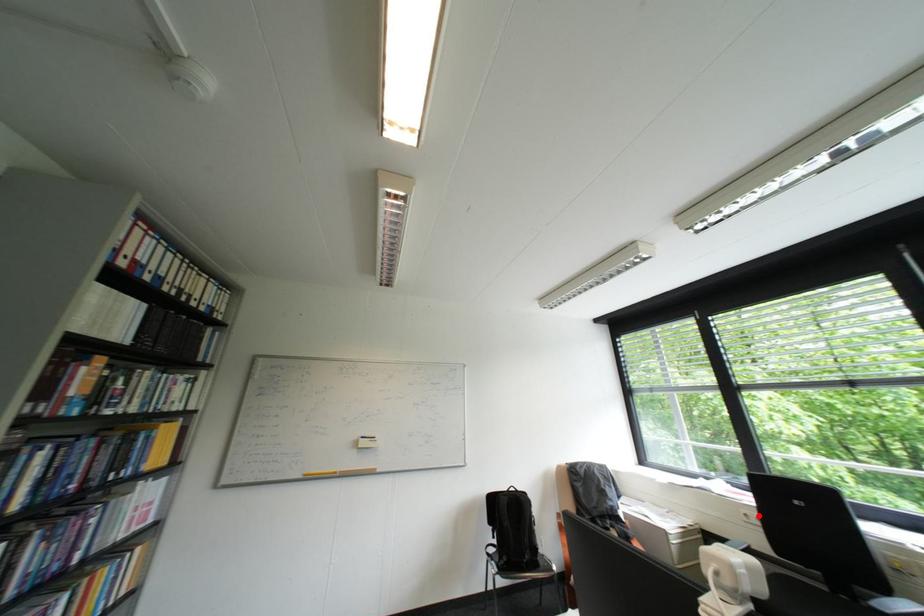
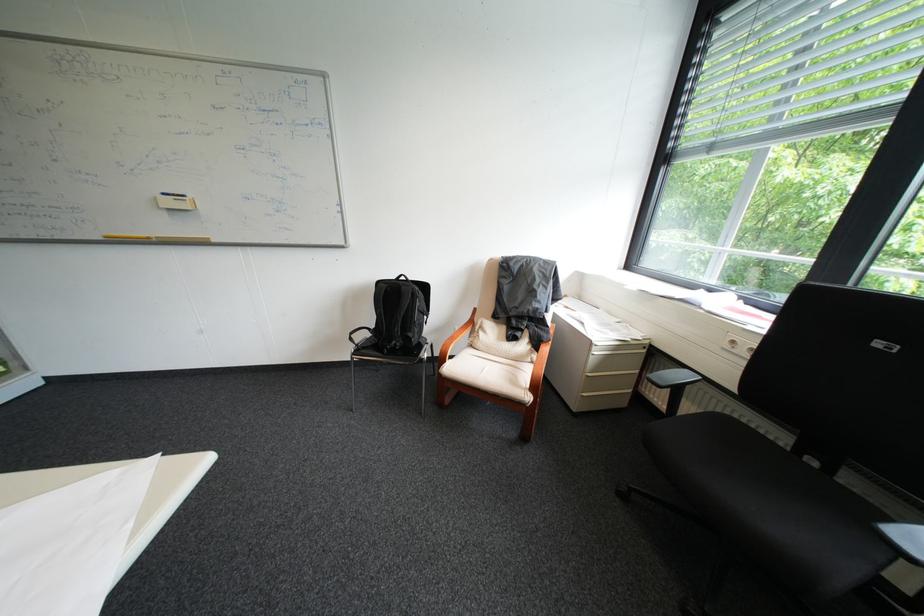
Question: I am providing you with two images of the same scene from different viewpoints. Given a red point in image1, look at the same physical point in image2. Is it:

Choices:
 (A) Closer to the viewpoint
 (B) Farther from the viewpoint

Answer: (B)